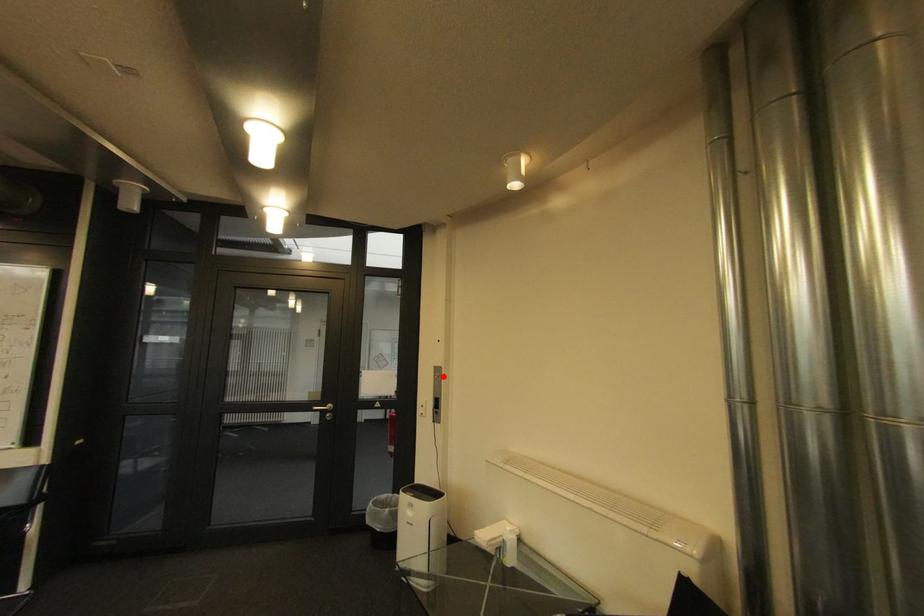
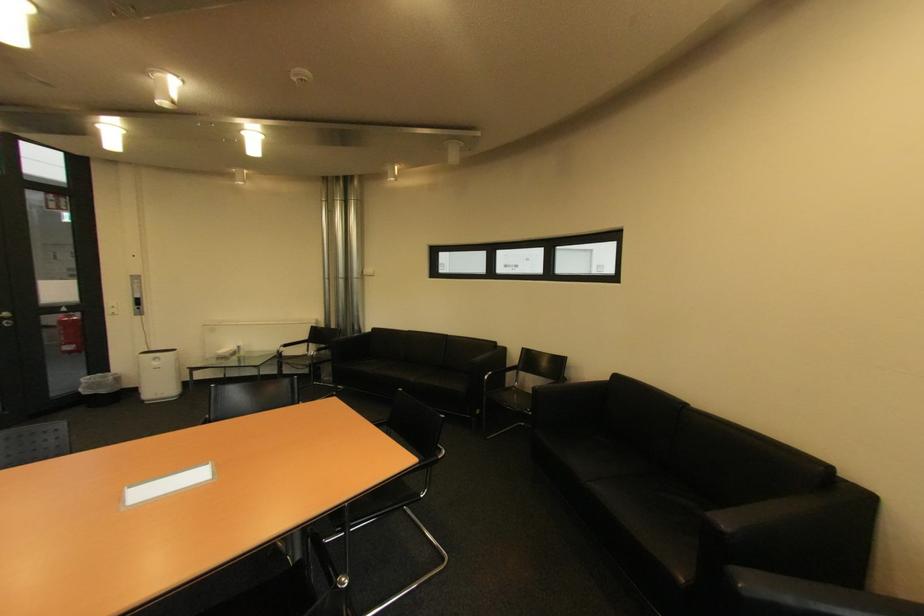
Locate, in the second image, the point that corresponds to the highlighted location in the first image.

(140, 283)